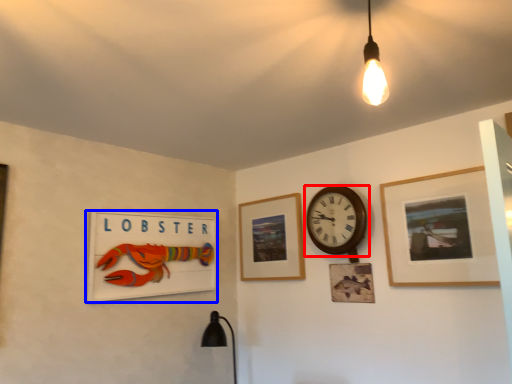
Question: Which point is further to the camera, wall clock (highlighted by a red box) or picture frame (highlighted by a blue box)?

Choices:
 (A) wall clock
 (B) picture frame

Answer: (A)